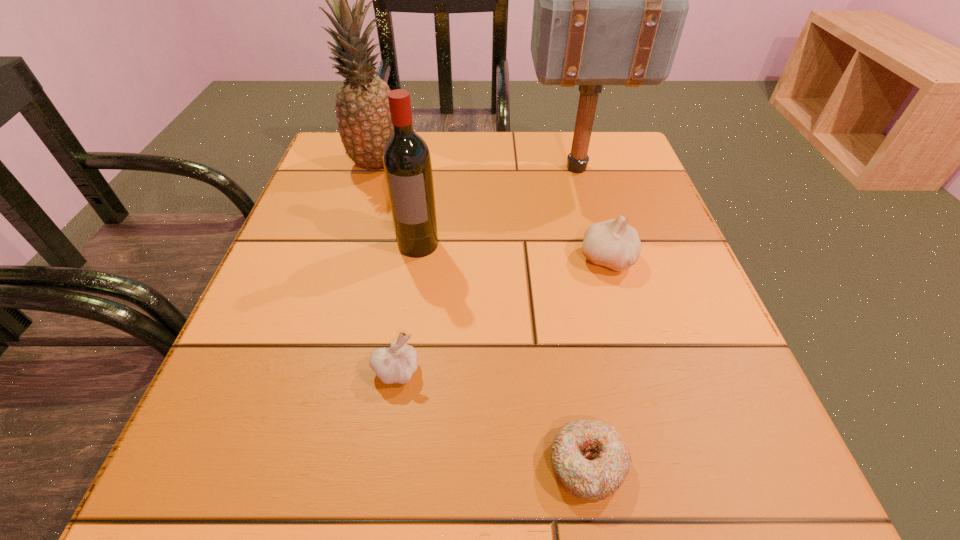
The height and width of the screenshot is (540, 960). In order to click on mallet in this screenshot , I will do `click(610, 0)`.

At what (x,y) coordinates should I click in order to perform the action: click on pineapple. Please return your answer as a coordinate pair (x, y). Image resolution: width=960 pixels, height=540 pixels. Looking at the image, I should click on (363, 115).

Where is `wine bottle`? wine bottle is located at coordinates (407, 164).

Identify the location of the taller garlic. Image resolution: width=960 pixels, height=540 pixels. (613, 243).

Where is `the farther garlic`? the farther garlic is located at coordinates (613, 243).

Identify the location of the fifth tallest object. This screenshot has height=540, width=960. (397, 364).

At what (x,y) coordinates should I click in order to perform the action: click on the nearer garlic. Please return your answer as a coordinate pair (x, y). This screenshot has width=960, height=540. Looking at the image, I should click on (397, 364).

In order to click on the shortest object in this screenshot , I will do `click(590, 459)`.

At what (x,y) coordinates should I click in order to perform the action: click on the nearest object. Please return your answer as a coordinate pair (x, y). Image resolution: width=960 pixels, height=540 pixels. Looking at the image, I should click on (590, 459).

I want to click on vacant area located on the striking surface of the mallet, so click(444, 168).